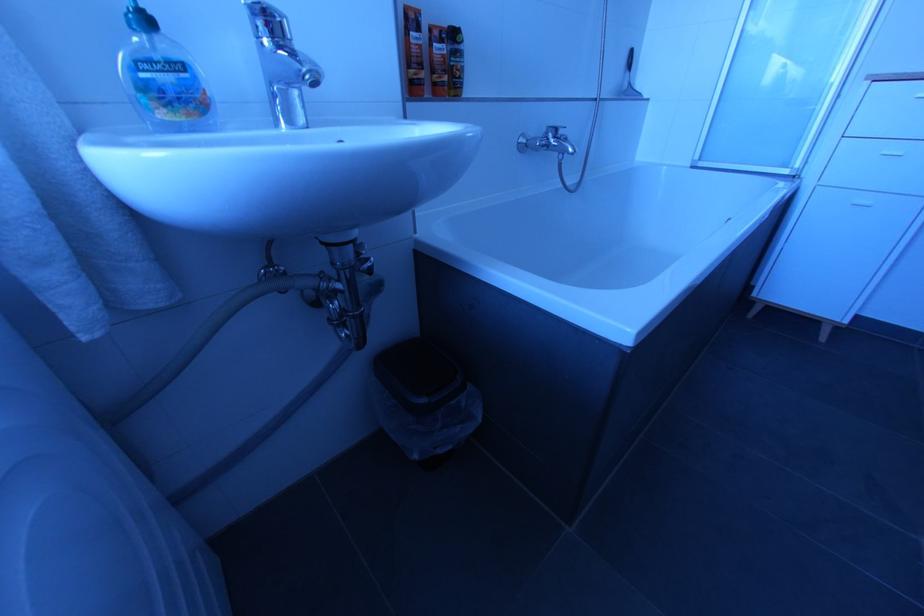
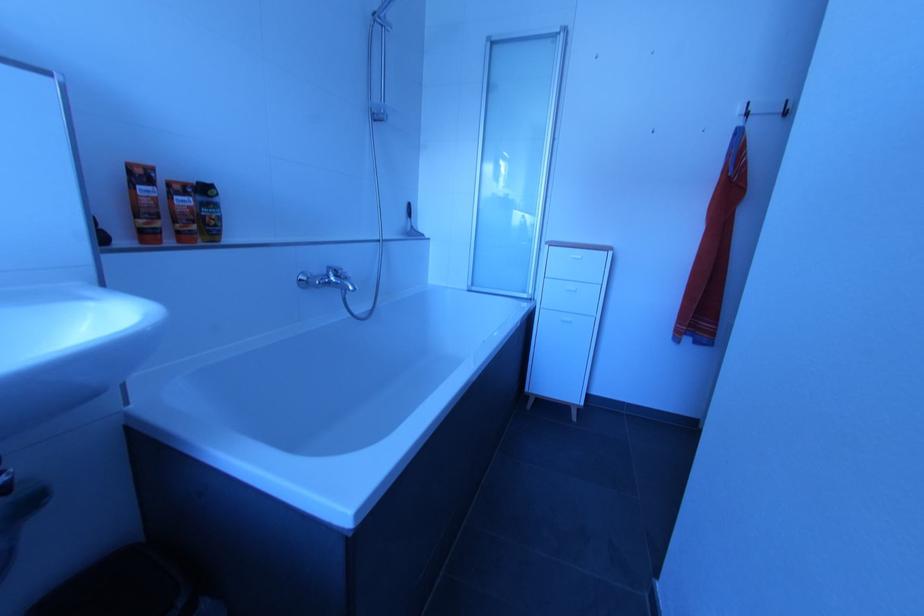
Question: Based on the continuous images, in which direction is the camera rotating? Reply with the corresponding letter.

Choices:
 (A) Left
 (B) Right
 (C) Up
 (D) Down

Answer: (B)